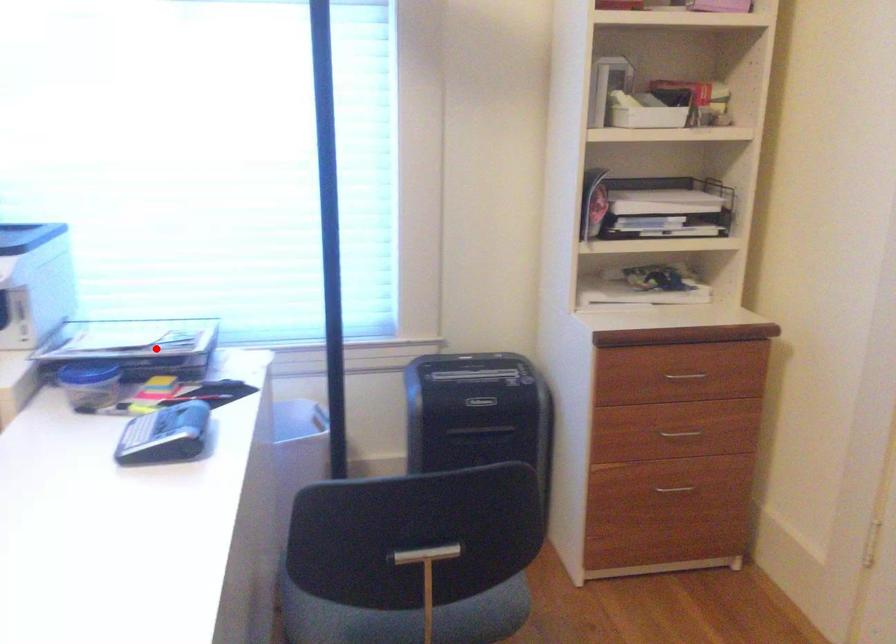
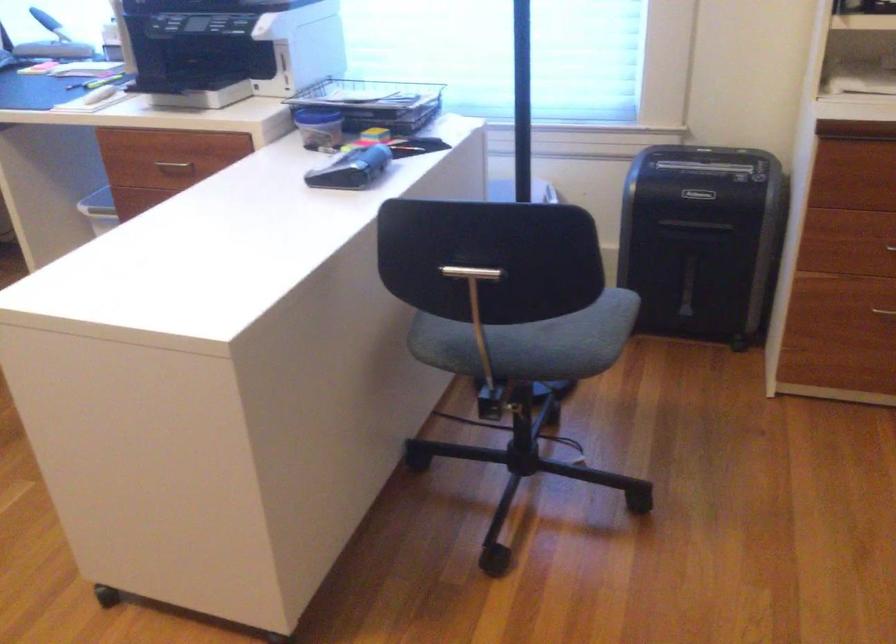
Question: I am providing you with two images of the same scene from different viewpoints. A red point is shown in image1. For the corresponding object point in image2, is it positioned nearer or farther from the camera?

Choices:
 (A) Nearer
 (B) Farther

Answer: (B)